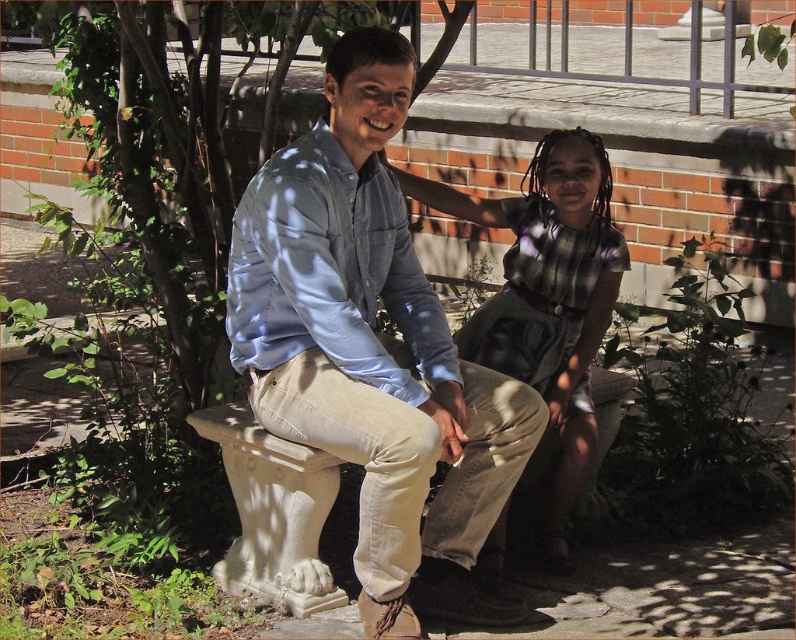
You are a fashion designer observing two shirts displayed on a model in the image. The shirts are the light blue denim shirt at center and the matte blue shirt at center. Which shirt has a wider width?

The light blue denim shirt at center has a wider width than the matte blue shirt at center according to the description.

You are a photographer trying to capture a clear shot of the light blue denim shirt at center and the matte blue shirt at center. Since the two shirts are overlapping, which one is closer to the camera?

The light blue denim shirt at center is positioned under the matte blue shirt at center, so the matte blue shirt at center is closer to the camera.